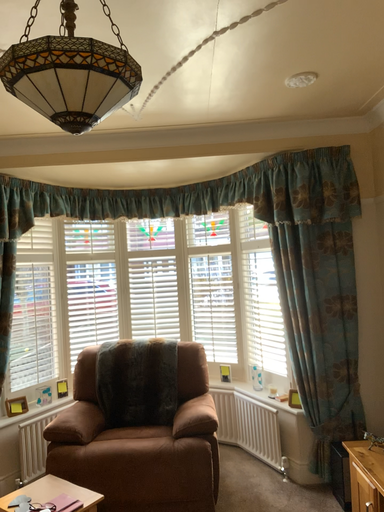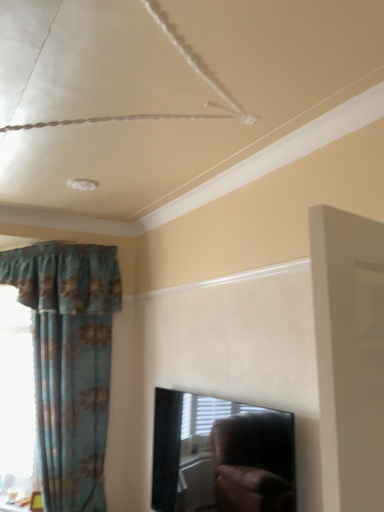
Question: Which way did the camera rotate in the video?

Choices:
 (A) rotated upward
 (B) rotated downward

Answer: (A)